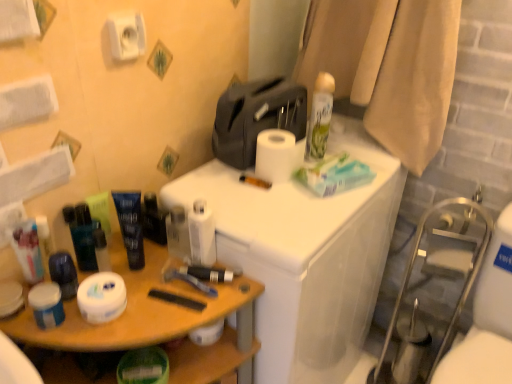
Find the location of a particular element. The width and height of the screenshot is (512, 384). blank space to the left of white glossy toilet paper at center, marked as the 2th toilet paper in a right-to-left arrangement is located at coordinates (147, 271).